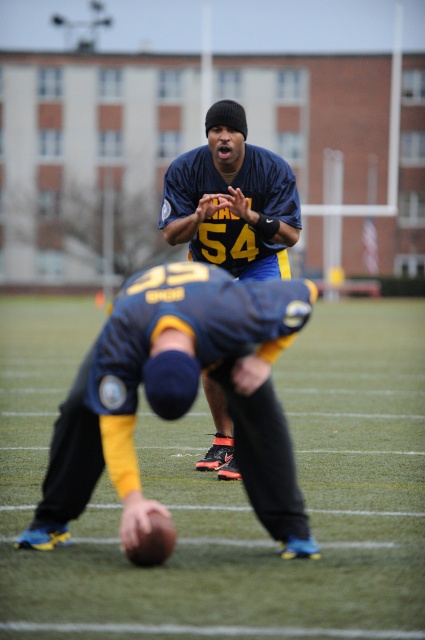
Is dark blue jersey at lower center thinner than matte blue jersey at center?

No.

Does dark blue jersey at lower center lie behind matte blue jersey at center?

That is False.

The width and height of the screenshot is (425, 640). I want to click on dark blue jersey at lower center, so coord(181,387).

Find the location of a particular element. Image resolution: width=425 pixels, height=640 pixels. dark blue jersey at lower center is located at coordinates (181, 387).

Does green artificial turf at center appear on the left side of dark blue jersey at lower center?

Incorrect, green artificial turf at center is not on the left side of dark blue jersey at lower center.

Which is in front, point (16, 307) or point (198, 339)?

Point (198, 339) is more forward.

The image size is (425, 640). What are the coordinates of `green artificial turf at center` in the screenshot? It's located at (229, 492).

How distant is green artificial turf at center from matte blue jersey at center?

green artificial turf at center and matte blue jersey at center are 13.00 feet apart.

Which of these two, green artificial turf at center or matte blue jersey at center, stands taller?

matte blue jersey at center is taller.

Image resolution: width=425 pixels, height=640 pixels. Find the location of `green artificial turf at center`. green artificial turf at center is located at coordinates (229, 492).